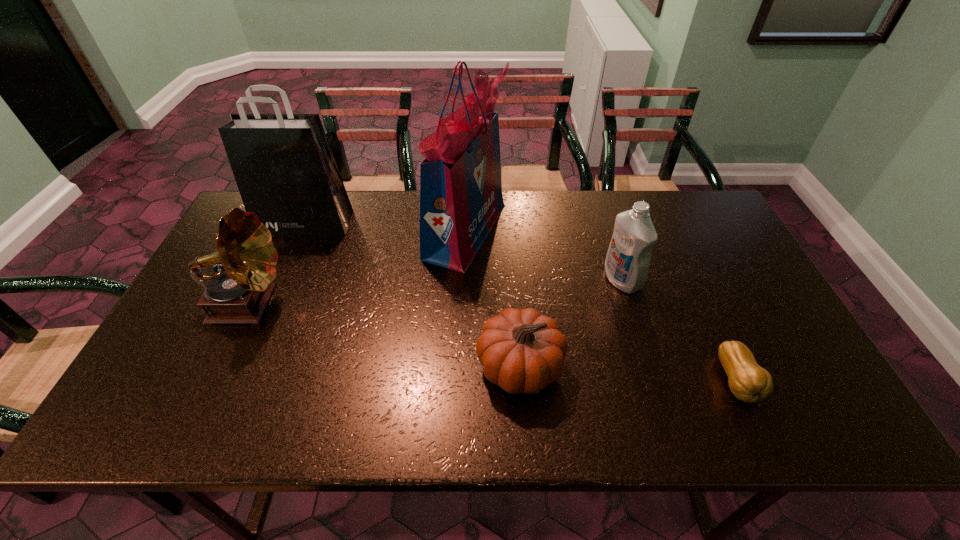
The width and height of the screenshot is (960, 540). In order to click on object that is at the right edge in this screenshot , I will do point(749,382).

The width and height of the screenshot is (960, 540). Identify the location of object located at the far left corner. (283, 165).

Where is `object positioned at the near right corner`? object positioned at the near right corner is located at coordinates (749, 382).

Find the location of a particular element. This screenshot has height=540, width=960. free space at the far edge of the desktop is located at coordinates (350, 193).

I want to click on vacant space at the near edge of the desktop, so click(319, 413).

Identify the location of free spot at the left edge of the desktop. (185, 390).

At what (x,y) coordinates should I click in order to perform the action: click on vacant area at the right edge of the desktop. Please return your answer as a coordinate pair (x, y). The height and width of the screenshot is (540, 960). Looking at the image, I should click on (765, 337).

Find the location of a particular element. This screenshot has height=540, width=960. free space at the far right corner of the desktop is located at coordinates (660, 200).

This screenshot has width=960, height=540. I want to click on vacant space that's between the second shortest object and the second tallest object, so click(413, 294).

Where is `vacant point located between the fifth shortest object and the fifth tallest object`? The width and height of the screenshot is (960, 540). vacant point located between the fifth shortest object and the fifth tallest object is located at coordinates (413, 294).